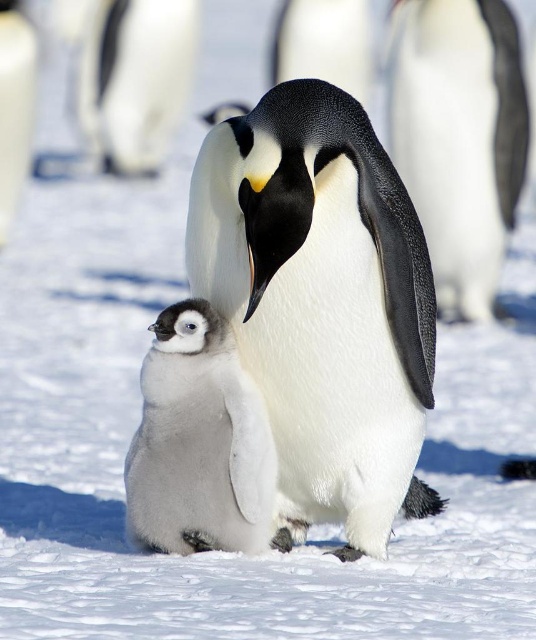
You are a wildlife photographer trying to capture a closeup of the white fluffy penguin at center. Based on the coordinates provided, where should you aim your camera to ensure the penguin is centered in your shot?

You should aim your camera at the coordinates point (322, 305) to center the white fluffy penguin at center in your shot.

You are a wildlife photographer observing two white fluffy penguins in the snow. You need to identify which penguin is more slender between the white fluffy penguin at center and the white fluffy penguin at upper left. Which one is it?

The white fluffy penguin at center is thinner than the white fluffy penguin at upper left, so the more slender one is the white fluffy penguin at center.